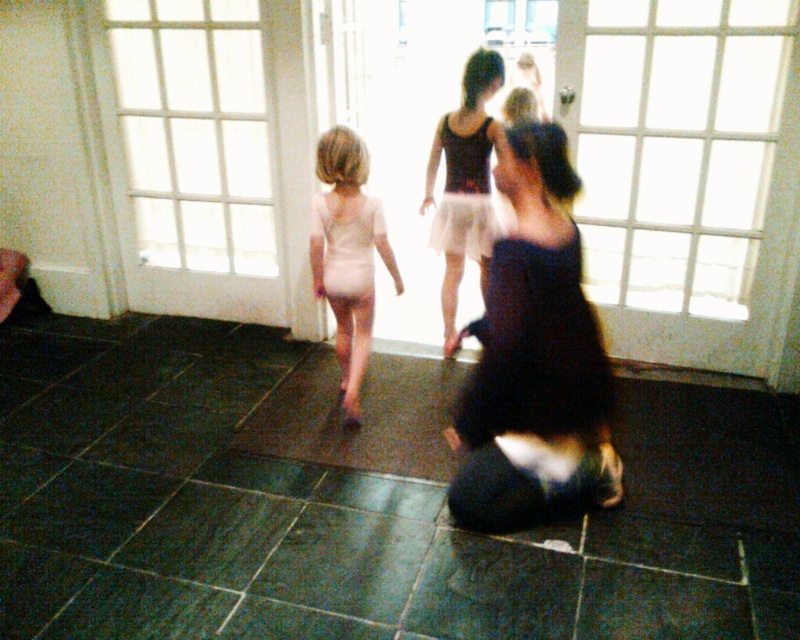
Question: Which of the following is the farthest from the observer?

Choices:
 (A) matte black leotard at center
 (B) dark purple dress at center

Answer: (A)

Question: Does white matte leotard at center appear over white matte dress at center?

Choices:
 (A) yes
 (B) no

Answer: (B)

Question: Can you confirm if dark purple dress at center is positioned to the left of white matte leotard at center?

Choices:
 (A) yes
 (B) no

Answer: (B)

Question: Among these points, which one is nearest to the camera?

Choices:
 (A) (338, 253)
 (B) (424, 189)
 (C) (488, 168)

Answer: (A)

Question: Is dark purple dress at center thinner than matte black leotard at center?

Choices:
 (A) no
 (B) yes

Answer: (A)

Question: Considering the real-world distances, which object is farthest from the white matte leotard at center?

Choices:
 (A) dark purple dress at center
 (B) white matte dress at center
 (C) matte black dress at center

Answer: (A)